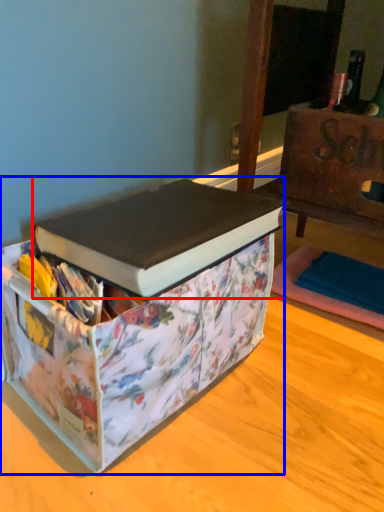
Question: Which of the following is the closest to the observer, book (highlighted by a red box) or box (highlighted by a blue box)?

Choices:
 (A) book
 (B) box

Answer: (B)